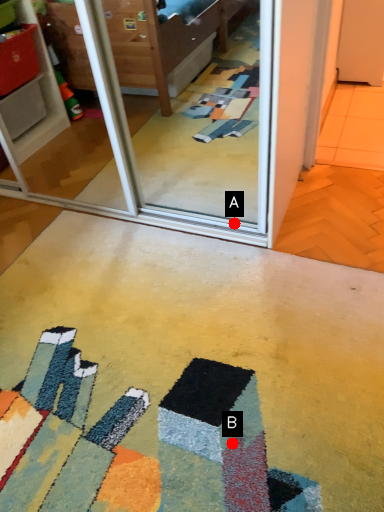
Question: Two points are circled on the image, labeled by A and B beside each circle. Which of the following is the farthest from the observer?

Choices:
 (A) A is further
 (B) B is further

Answer: (A)